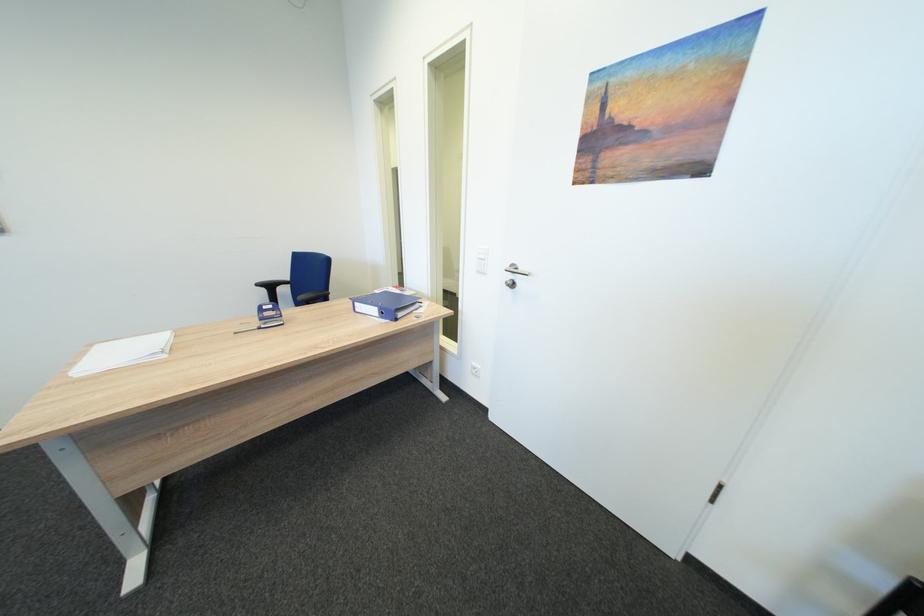
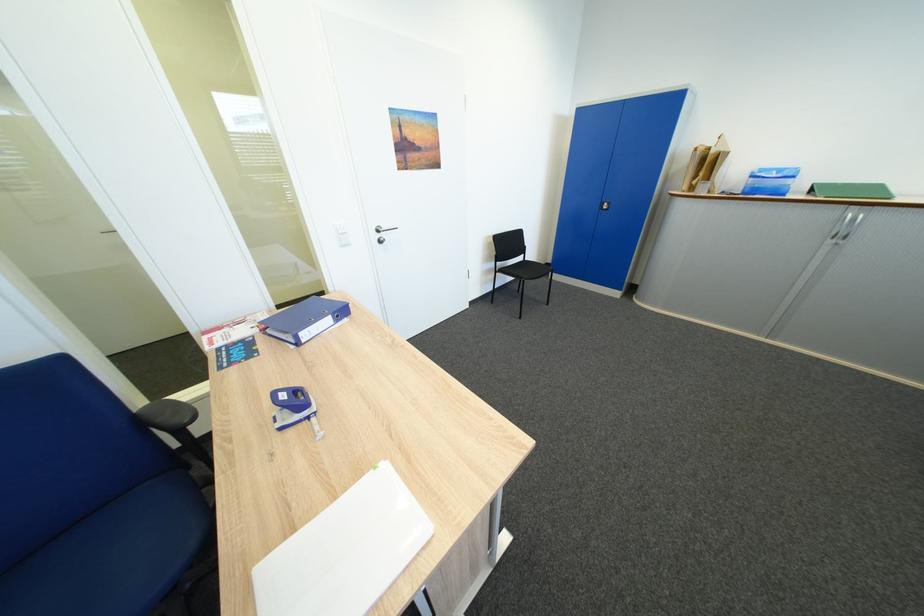
The point at (367, 305) is marked in the first image. Where is the corresponding point in the second image?

(310, 334)